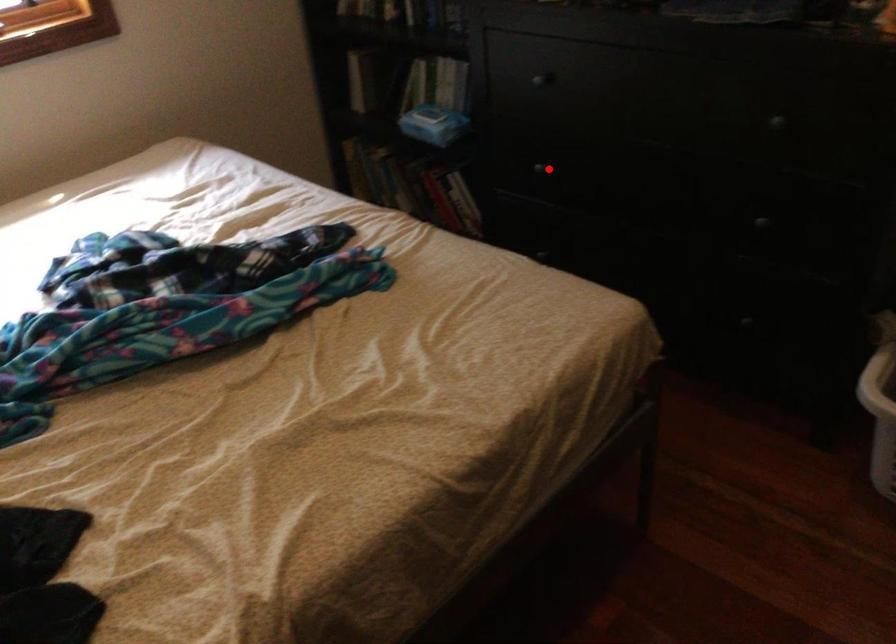
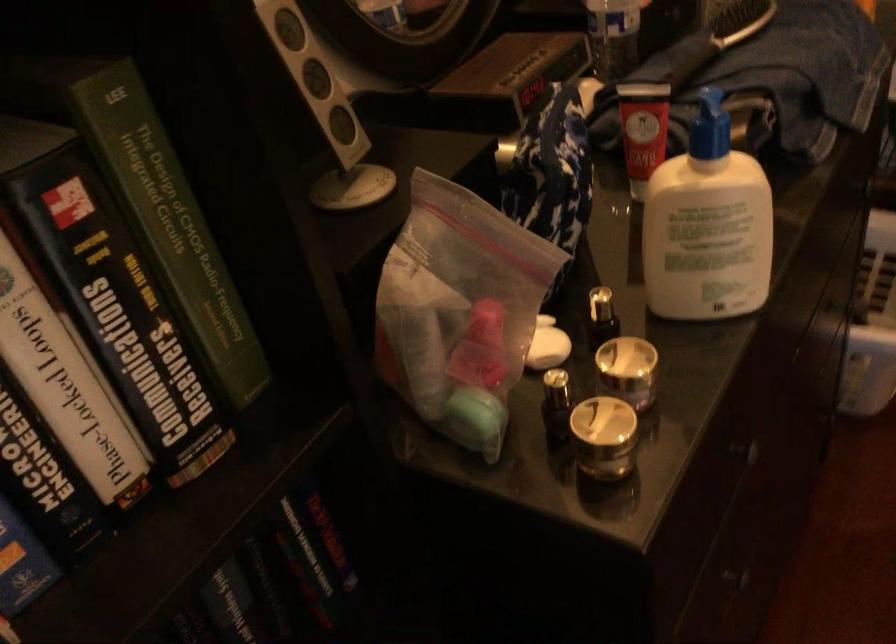
Where in the second image is the point corresponding to the highlighted location from the first image?

(738, 581)